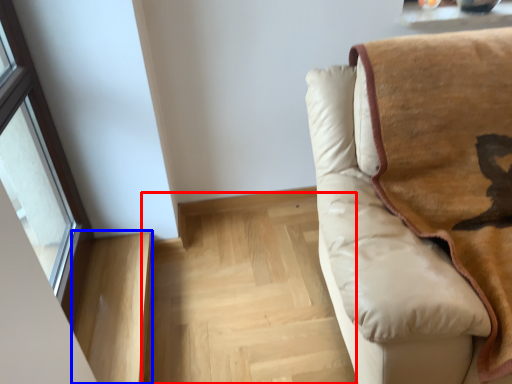
Question: Which object is closer to the camera taking this photo, stairwell (highlighted by a red box) or stairwell (highlighted by a blue box)?

Choices:
 (A) stairwell
 (B) stairwell

Answer: (B)